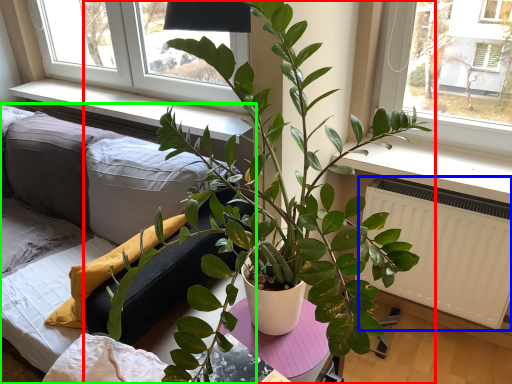
Question: Estimate the real-world distances between objects in this image. Which object is closer to houseplant (highlighted by a red box), radiator (highlighted by a blue box) or studio couch (highlighted by a green box)?

Choices:
 (A) radiator
 (B) studio couch

Answer: (B)